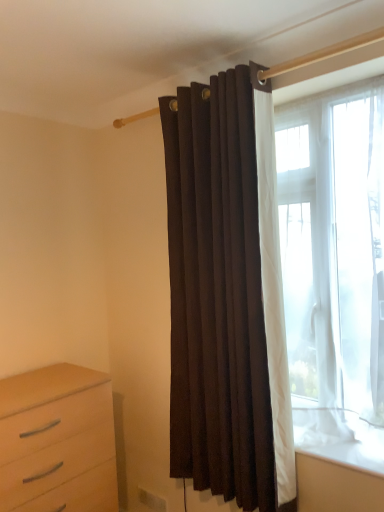
Find the location of `free space above light wood chest of drawers at lower left (from a real-world perspective)`. free space above light wood chest of drawers at lower left (from a real-world perspective) is located at coordinates [x=44, y=384].